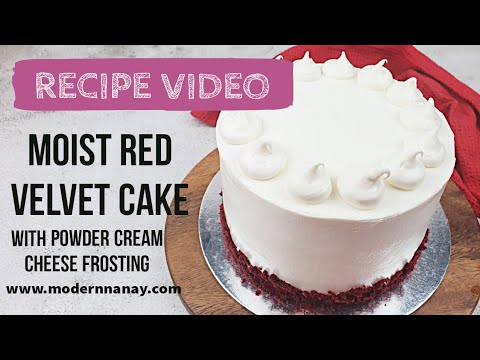
Where is `white countertop`? white countertop is located at coordinates (118, 309).